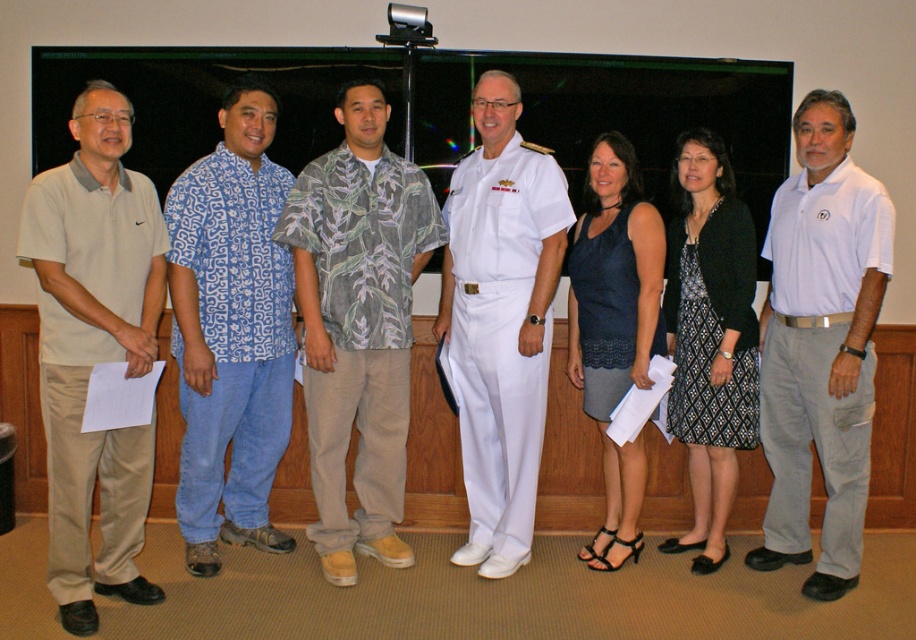
You are organizing a charity event and need to decide which outfit to donate. You have the beige cotton polo shirt at left and the black textured dress at center. Based on their sizes, which one should you choose to donate first?

The beige cotton polo shirt at left is bigger than the black textured dress at center, so you should donate the beige cotton polo shirt at left first since it takes up more space.

Based on the photo, you are organizing a photoshoot and need to arrange the printed fabric shirt at center and the black textured dress at center in a specific order. According to the scene description, which clothing item is located to the left of the other?

The printed fabric shirt at center is positioned on the left side of black textured dress at center.

Which object is located at the coordinates point (94, 349)?

The beige cotton polo shirt at left is located at point (94, 349).